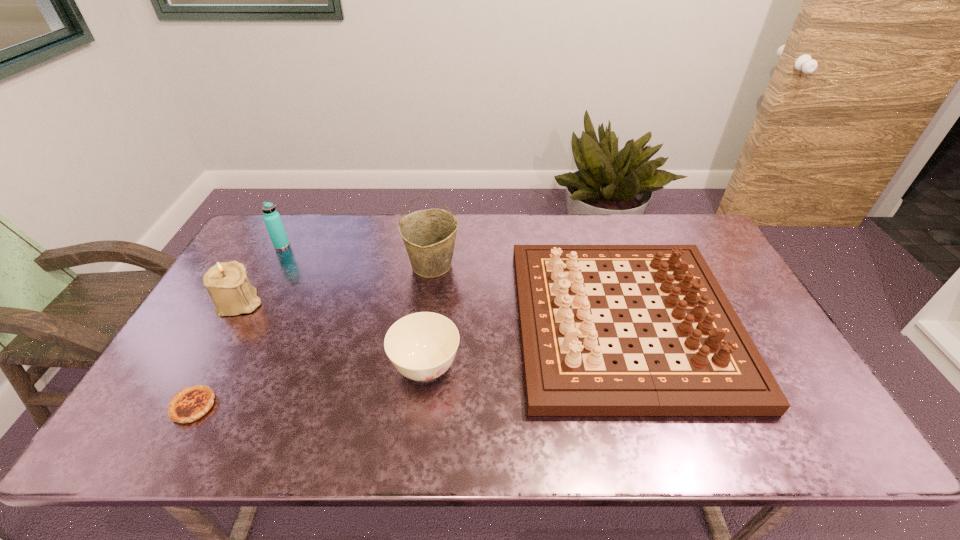
You are a GUI agent. You are given a task and a screenshot of the screen. Output one action in this format:
    pyautogui.click(x=<x>, y=<y>)
    Task: Click on the tallest object
    This screenshot has height=540, width=960.
    Given the screenshot: What is the action you would take?
    pyautogui.click(x=429, y=236)

You are a GUI agent. You are given a task and a screenshot of the screen. Output one action in this format:
    pyautogui.click(x=<x>, y=<y>)
    Task: Click on the water bottle
    The width and height of the screenshot is (960, 540).
    Given the screenshot: What is the action you would take?
    pyautogui.click(x=273, y=222)

Identify the location of candle_holder. This screenshot has width=960, height=540. (227, 283).

Find the location of a particular element. The image size is (960, 540). gameboard is located at coordinates (568, 367).

Locate an element on the screen. This screenshot has width=960, height=540. the rightmost object is located at coordinates pyautogui.click(x=568, y=367).

The width and height of the screenshot is (960, 540). What are the coordinates of `sugar bowl` in the screenshot? It's located at (422, 346).

At what (x,y) coordinates should I click in order to perform the action: click on quiche. Please return your answer as a coordinate pair (x, y). This screenshot has width=960, height=540. Looking at the image, I should click on (189, 404).

Locate an element on the screen. This screenshot has width=960, height=540. vacant space located on the right of the tallest object is located at coordinates (532, 266).

The height and width of the screenshot is (540, 960). In order to click on free spot located on the back of the water bottle in this screenshot , I will do `click(295, 221)`.

The width and height of the screenshot is (960, 540). In order to click on vacant area located 0.110m on the right of the candle_holder in this screenshot , I will do (300, 302).